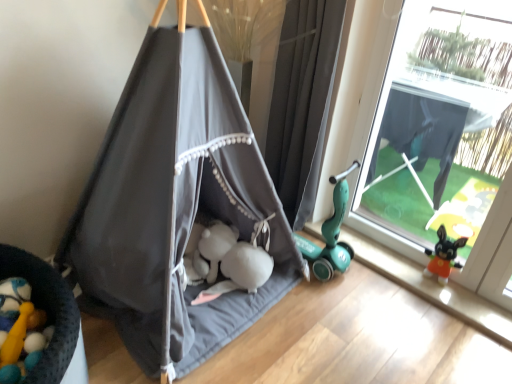
Locate an element on the screen. gray fabric curtain at right is located at coordinates (302, 102).

In order to face dark gray fabric tent at center, should I rotate leftwards or rightwards?

It's best to rotate left around 9.808 degrees.

Measure the distance between dark gray fabric tent at center and camera.

dark gray fabric tent at center is 4.83 feet from camera.

The image size is (512, 384). I want to click on transparent plastic window at right, so click(447, 138).

Image resolution: width=512 pixels, height=384 pixels. What do you see at coordinates (447, 138) in the screenshot?
I see `transparent plastic window at right` at bounding box center [447, 138].

Locate an element on the screen. gray fabric curtain at right is located at coordinates (302, 102).

Considering the relative sizes of transparent plastic window at right and dark gray fabric tent at center in the image provided, is transparent plastic window at right thinner than dark gray fabric tent at center?

Indeed, transparent plastic window at right has a lesser width compared to dark gray fabric tent at center.

Considering the sizes of objects transparent plastic window at right and dark gray fabric tent at center in the image provided, who is taller, transparent plastic window at right or dark gray fabric tent at center?

dark gray fabric tent at center.

Which is more to the right, transparent plastic window at right or dark gray fabric tent at center?

transparent plastic window at right.

Which of these two, transparent plastic window at right or dark gray fabric tent at center, is bigger?

dark gray fabric tent at center is bigger.

Is dark gray fabric tent at center in contact with transparent plastic window at right?

No, dark gray fabric tent at center is not in contact with transparent plastic window at right.

Consider the image. From a real-world perspective, is dark gray fabric tent at center above or below transparent plastic window at right?

In terms of real-world spatial position, dark gray fabric tent at center is below transparent plastic window at right.

What's the angular difference between dark gray fabric tent at center and transparent plastic window at right's facing directions?

There is a 89.1-degree angle between the facing directions of dark gray fabric tent at center and transparent plastic window at right.

At what (x,y) coordinates should I click in order to perform the action: click on window behind the dark gray fabric tent at center. Please return your answer as a coordinate pair (x, y). The width and height of the screenshot is (512, 384). Looking at the image, I should click on coord(447,138).

The image size is (512, 384). I want to click on curtain behind the dark gray fabric tent at center, so click(x=302, y=102).

Who is bigger, dark gray fabric tent at center or gray fabric curtain at right?

Bigger between the two is dark gray fabric tent at center.

From their relative heights in the image, would you say dark gray fabric tent at center is taller or shorter than gray fabric curtain at right?

dark gray fabric tent at center is taller than gray fabric curtain at right.

From their relative heights in the image, would you say transparent plastic window at right is taller or shorter than gray fabric curtain at right?

In the image, transparent plastic window at right appears to be taller than gray fabric curtain at right.

Considering the sizes of objects transparent plastic window at right and gray fabric curtain at right in the image provided, who is wider, transparent plastic window at right or gray fabric curtain at right?

gray fabric curtain at right.

How different are the orientations of transparent plastic window at right and gray fabric curtain at right in degrees?

There is a 1.17-degree angle between the facing directions of transparent plastic window at right and gray fabric curtain at right.

Is transparent plastic window at right placed right next to gray fabric curtain at right?

No, transparent plastic window at right is not with gray fabric curtain at right.

Which of these two, gray fabric curtain at right or transparent plastic window at right, stands taller?

transparent plastic window at right.

Is gray fabric curtain at right in front of or behind transparent plastic window at right in the image?

Clearly, gray fabric curtain at right is behind transparent plastic window at right.

Which is correct: gray fabric curtain at right is inside transparent plastic window at right, or outside of it?

gray fabric curtain at right is spatially situated outside transparent plastic window at right.

Is gray fabric curtain at right next to transparent plastic window at right?

They are not placed beside each other.

Between gray fabric curtain at right and dark gray fabric tent at center, which one has less height?

gray fabric curtain at right.

Between point (286, 156) and point (208, 180), which one is positioned behind?

The point (286, 156) is farther from the camera.

What are the coordinates of `curtain that is on the right side of dark gray fabric tent at center` in the screenshot? It's located at (302, 102).

Is dark gray fabric tent at center a part of gray fabric curtain at right?

No, gray fabric curtain at right does not contain dark gray fabric tent at center.

The height and width of the screenshot is (384, 512). Find the location of `tent in front of the transparent plastic window at right`. tent in front of the transparent plastic window at right is located at coordinates (172, 199).

Locate an element on the screen. window that appears above the dark gray fabric tent at center (from the image's perspective) is located at coordinates (447, 138).

Estimate the real-world distances between objects in this image. Which object is further from dark gray fabric tent at center, gray fabric curtain at right or transparent plastic window at right?

Among the two, transparent plastic window at right is located further to dark gray fabric tent at center.

Based on their spatial positions, is transparent plastic window at right or dark gray fabric tent at center further from gray fabric curtain at right?

transparent plastic window at right.

Looking at the image, which one is located closer to gray fabric curtain at right, dark gray fabric tent at center or transparent plastic window at right?

Among the two, dark gray fabric tent at center is located nearer to gray fabric curtain at right.

In the scene shown: Which object lies further to the anchor point dark gray fabric tent at center, transparent plastic window at right or gray fabric curtain at right?

transparent plastic window at right is further to dark gray fabric tent at center.

Estimate the real-world distances between objects in this image. Which object is further from transparent plastic window at right, dark gray fabric tent at center or gray fabric curtain at right?

dark gray fabric tent at center lies further to transparent plastic window at right than the other object.

Which object lies nearer to the anchor point transparent plastic window at right, gray fabric curtain at right or dark gray fabric tent at center?

Among the two, gray fabric curtain at right is located nearer to transparent plastic window at right.

At what (x,y) coordinates should I click in order to perform the action: click on curtain situated between dark gray fabric tent at center and transparent plastic window at right from left to right. Please return your answer as a coordinate pair (x, y). The image size is (512, 384). Looking at the image, I should click on (302, 102).